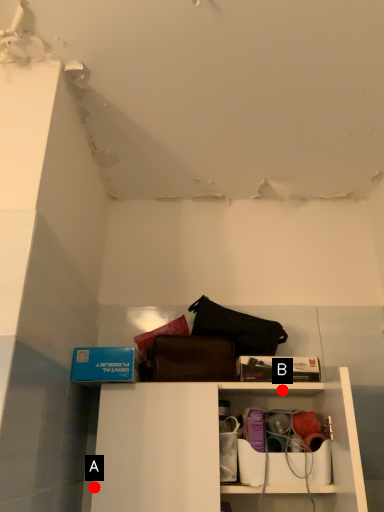
Question: Two points are circled on the image, labeled by A and B beside each circle. Among these points, which one is nearest to the camera?

Choices:
 (A) A is closer
 (B) B is closer

Answer: (A)